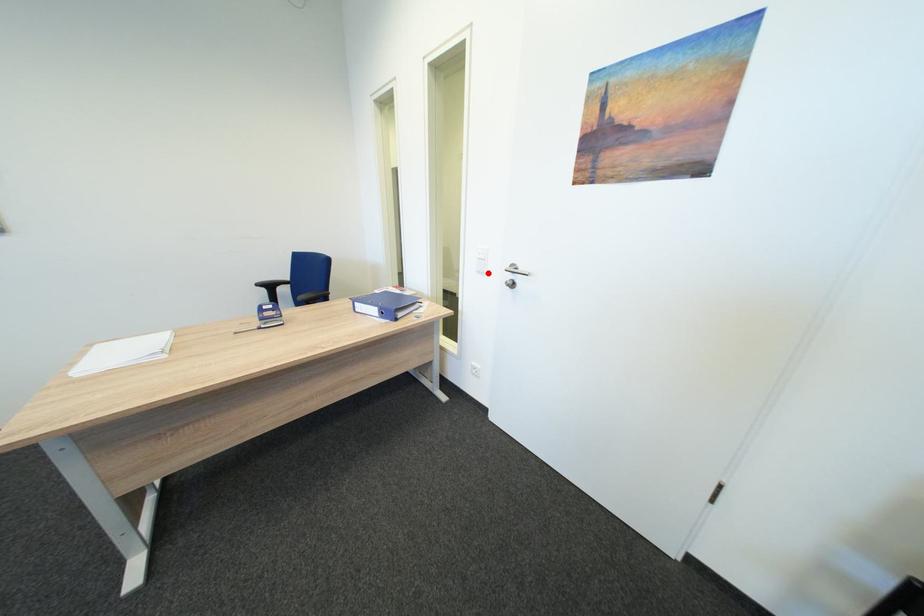
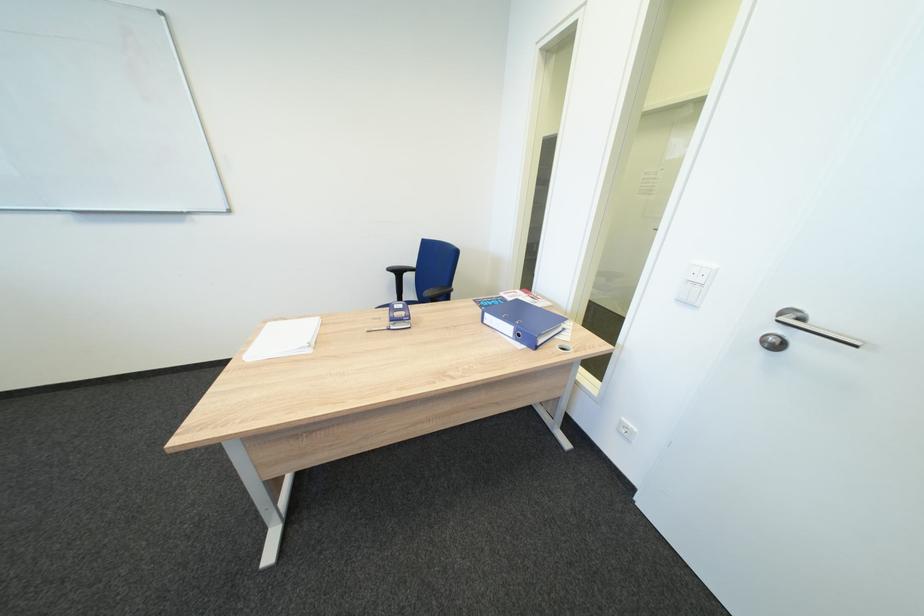
In the second image, find the point that corresponds to the highlighted location in the first image.

(687, 302)